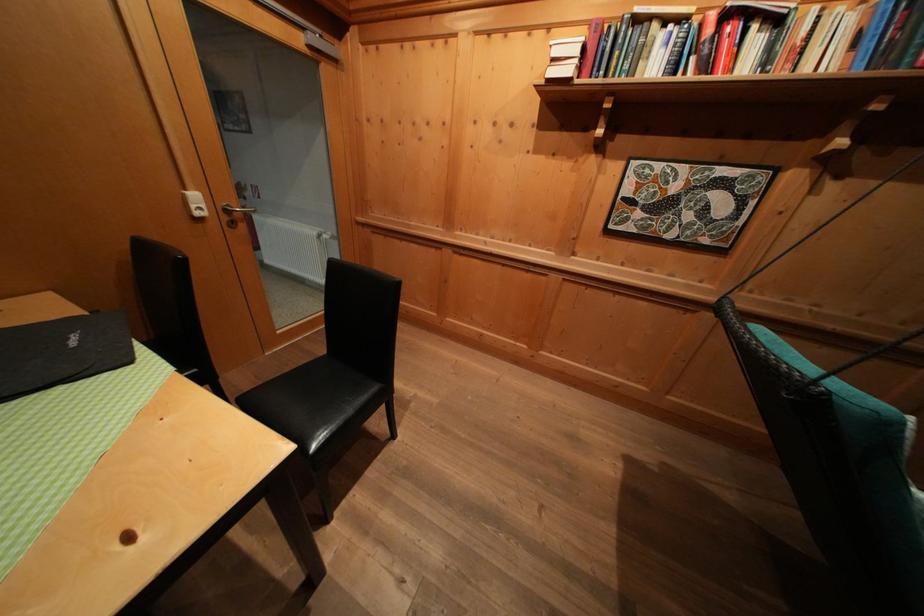
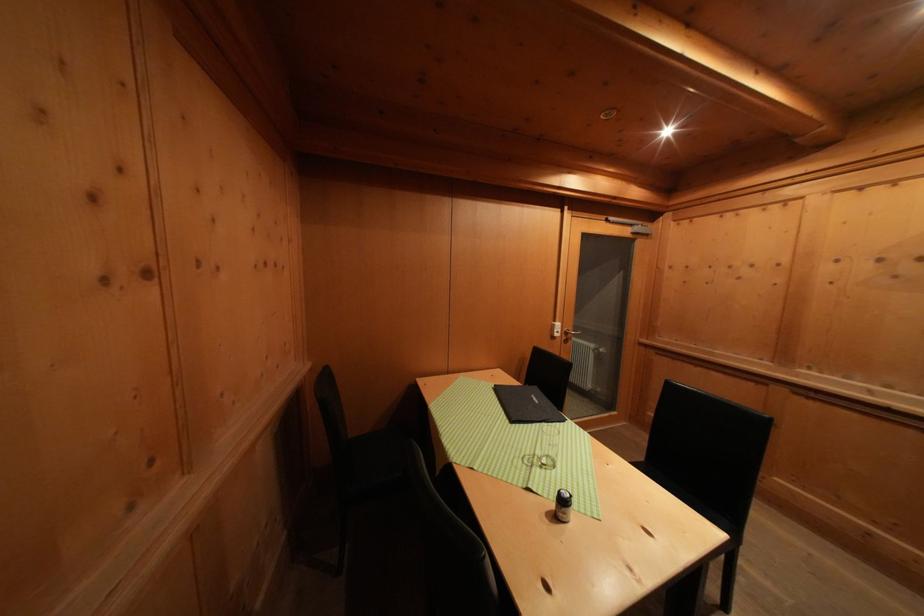
From the picture: Based on the continuous images, in which direction is the camera rotating?

The camera rotated toward left-up.